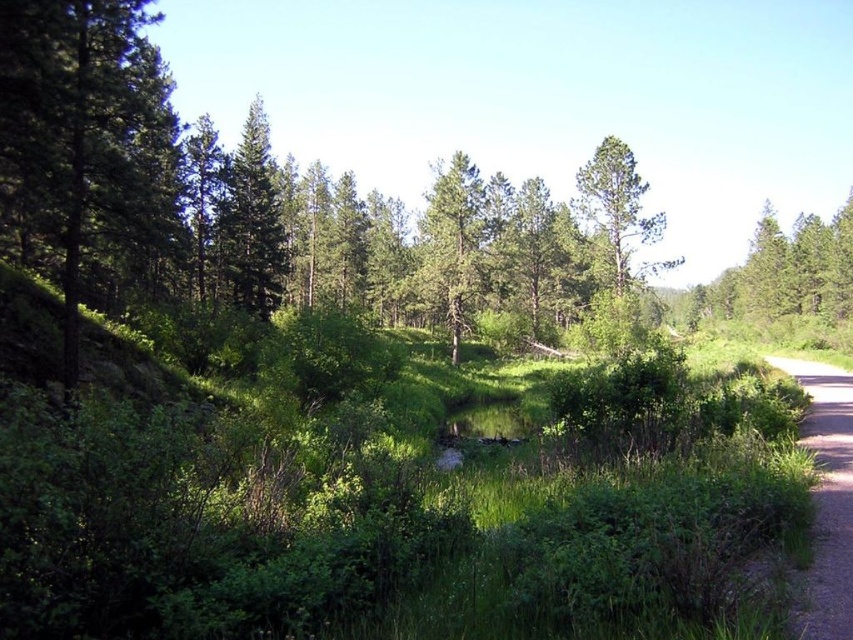
Who is shorter, dirt/gravel path at right or green textured tree at center?

With less height is dirt/gravel path at right.

Does dirt/gravel path at right appear under green textured tree at center?

Yes.

Which is behind, point (819, 518) or point (451, 275)?

Point (451, 275)

Where is `dirt/gravel path at right`? The width and height of the screenshot is (853, 640). dirt/gravel path at right is located at coordinates (827, 497).

Is green matte tree at left wider than green matte tree at upper left?

Yes, green matte tree at left is wider than green matte tree at upper left.

Does point (41, 252) come farther from viewer compared to point (258, 236)?

No, it is not.

Find the location of a particular element. green matte tree at left is located at coordinates (82, 145).

Can you confirm if dirt/gravel path at right is positioned to the left of green matte tree at upper left?

In fact, dirt/gravel path at right is to the right of green matte tree at upper left.

From the picture: Can you confirm if dirt/gravel path at right is bigger than green matte tree at upper left?

No.

The height and width of the screenshot is (640, 853). Find the location of `dirt/gravel path at right`. dirt/gravel path at right is located at coordinates (827, 497).